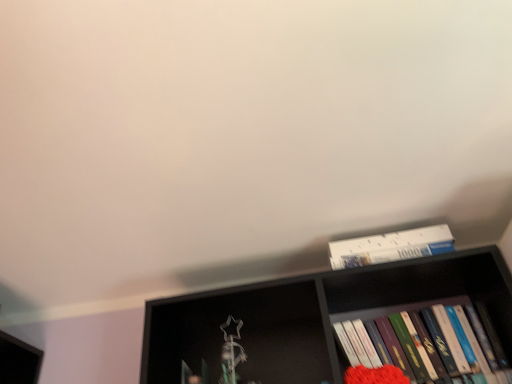
Question: Considering the relative sizes of white paperboard puzzle at upper right, placed as the first book when sorted from top to bottom, and hardcover books at right, the second book from the top, in the image provided, is white paperboard puzzle at upper right, placed as the first book when sorted from top to bottom, bigger than hardcover books at right, the second book from the top,?

Choices:
 (A) no
 (B) yes

Answer: (A)

Question: From the image's perspective, would you say white paperboard puzzle at upper right, placed as the first book when sorted from top to bottom, is positioned over hardcover books at right, the first book positioned from the bottom?

Choices:
 (A) yes
 (B) no

Answer: (A)

Question: Considering the relative positions of white paperboard puzzle at upper right, placed as the first book when sorted from top to bottom, and hardcover books at right, the second book from the top, in the image provided, is white paperboard puzzle at upper right, placed as the first book when sorted from top to bottom, to the right of hardcover books at right, the second book from the top, from the viewer's perspective?

Choices:
 (A) yes
 (B) no

Answer: (B)

Question: Does white paperboard puzzle at upper right, placed as the first book when sorted from top to bottom, have a greater height compared to hardcover books at right, the first book positioned from the bottom?

Choices:
 (A) no
 (B) yes

Answer: (A)

Question: Does white paperboard puzzle at upper right, placed as the first book when sorted from top to bottom, have a smaller size compared to hardcover books at right, the first book positioned from the bottom?

Choices:
 (A) no
 (B) yes

Answer: (B)

Question: From their relative heights in the image, would you say hardcover books at right, the second book from the top, is taller or shorter than black matte bookshelf at upper center?

Choices:
 (A) short
 (B) tall

Answer: (A)

Question: Is hardcover books at right, the second book from the top, to the left or to the right of black matte bookshelf at upper center in the image?

Choices:
 (A) right
 (B) left

Answer: (A)

Question: In the image, is hardcover books at right, the first book positioned from the bottom, positioned in front of or behind black matte bookshelf at upper center?

Choices:
 (A) behind
 (B) front

Answer: (A)

Question: Is hardcover books at right, the first book positioned from the bottom, wider or thinner than black matte bookshelf at upper center?

Choices:
 (A) thin
 (B) wide

Answer: (A)

Question: Is point (340, 251) positioned closer to the camera than point (208, 367)?

Choices:
 (A) closer
 (B) farther

Answer: (A)

Question: Visually, is white paperboard puzzle at upper right, placed as the first book when sorted from top to bottom, positioned to the left or to the right of black matte bookshelf at upper center?

Choices:
 (A) right
 (B) left

Answer: (A)

Question: From a real-world perspective, is white paperboard puzzle at upper right, the 2th book from the bottom, above or below black matte bookshelf at upper center?

Choices:
 (A) above
 (B) below

Answer: (A)

Question: Is white paperboard puzzle at upper right, placed as the first book when sorted from top to bottom, spatially inside black matte bookshelf at upper center, or outside of it?

Choices:
 (A) outside
 (B) inside

Answer: (A)

Question: Looking at the image, does black matte bookshelf at upper center seem bigger or smaller compared to hardcover books at right, the first book positioned from the bottom?

Choices:
 (A) big
 (B) small

Answer: (A)

Question: In the image, is black matte bookshelf at upper center positioned in front of or behind hardcover books at right, the first book positioned from the bottom?

Choices:
 (A) behind
 (B) front

Answer: (B)